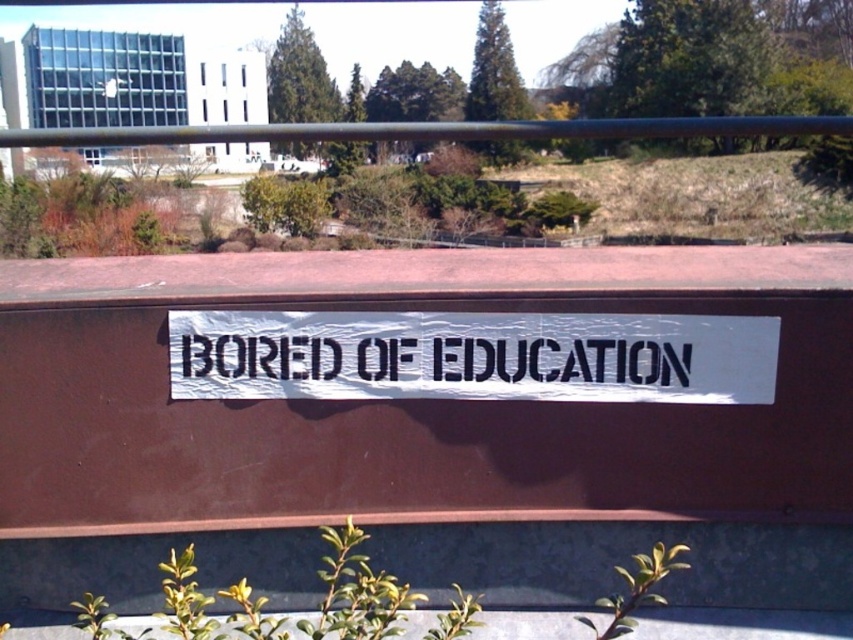
Question: Can you confirm if white paper sign at center is wider than black metal rail at upper center?

Choices:
 (A) no
 (B) yes

Answer: (A)

Question: Among these objects, which one is nearest to the camera?

Choices:
 (A) black metal rail at upper center
 (B) black paper at center

Answer: (B)

Question: Which point appears farthest from the camera in this image?

Choices:
 (A) (653, 326)
 (B) (480, 384)

Answer: (B)

Question: Is white paper sign at center thinner than black metal rail at upper center?

Choices:
 (A) yes
 (B) no

Answer: (A)

Question: Estimate the real-world distances between objects in this image. Which object is closer to the black paper at center?

Choices:
 (A) black metal rail at upper center
 (B) white paper sign at center

Answer: (B)

Question: Does white paper sign at center have a larger size compared to black paper at center?

Choices:
 (A) no
 (B) yes

Answer: (B)